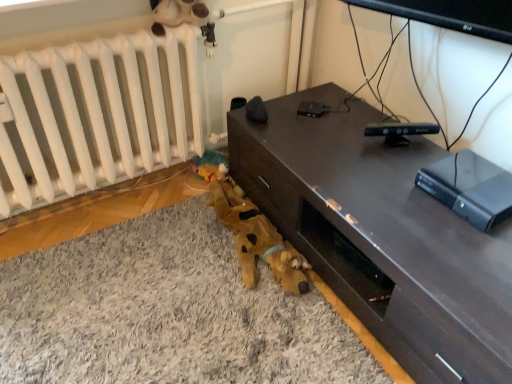
You are a GUI agent. You are given a task and a screenshot of the screen. Output one action in this format:
    pyautogui.click(x=<x>, y=<y>)
    Task: Click on the vacant area located to the right-hand side of black plastic remote control at upper center, which ranks as the first gadget in front-to-back order
    The width and height of the screenshot is (512, 384).
    Given the screenshot: What is the action you would take?
    pyautogui.click(x=444, y=146)